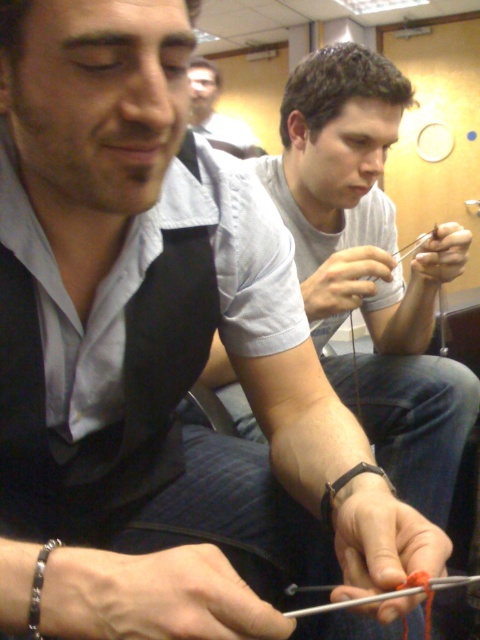
What do you see at coordinates (372, 268) in the screenshot?
I see `gray matte shirt at center` at bounding box center [372, 268].

Who is shorter, gray matte shirt at center or gray striped shirt at upper center?

gray striped shirt at upper center is shorter.

At what (x,y) coordinates should I click in order to perform the action: click on gray matte shirt at center. Please return your answer as a coordinate pair (x, y). Looking at the image, I should click on (372, 268).

Image resolution: width=480 pixels, height=640 pixels. In order to click on gray matte shirt at center in this screenshot , I will do `click(372, 268)`.